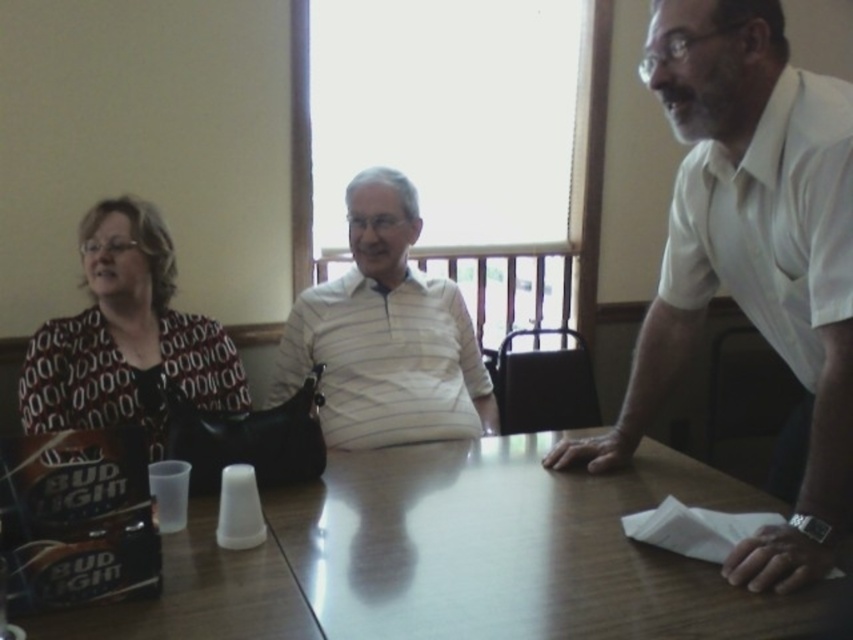
Question: Observing the image, what is the correct spatial positioning of wooden table at center in reference to printed fabric blouse at left?

Choices:
 (A) above
 (B) below

Answer: (B)

Question: Can you confirm if white smooth shirt at right is wider than white striped polo shirt at center?

Choices:
 (A) yes
 (B) no

Answer: (B)

Question: Which is farther from the wooden table at center?

Choices:
 (A) white smooth shirt at right
 (B) white striped polo shirt at center
 (C) printed fabric blouse at left

Answer: (C)

Question: Among these objects, which one is farthest from the camera?

Choices:
 (A) wooden table at center
 (B) white smooth shirt at right

Answer: (B)

Question: Is wooden table at center bigger than white striped polo shirt at center?

Choices:
 (A) yes
 (B) no

Answer: (A)

Question: Which point is closer to the camera?

Choices:
 (A) printed fabric blouse at left
 (B) white smooth shirt at right

Answer: (B)